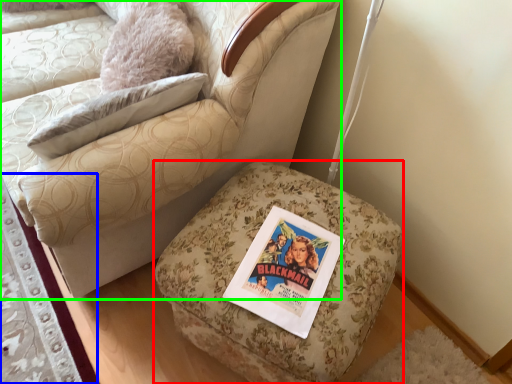
Question: Estimate the real-world distances between objects in this image. Which object is closer to furniture (highlighted by a red box), mat (highlighted by a blue box) or chair (highlighted by a green box)?

Choices:
 (A) mat
 (B) chair

Answer: (B)